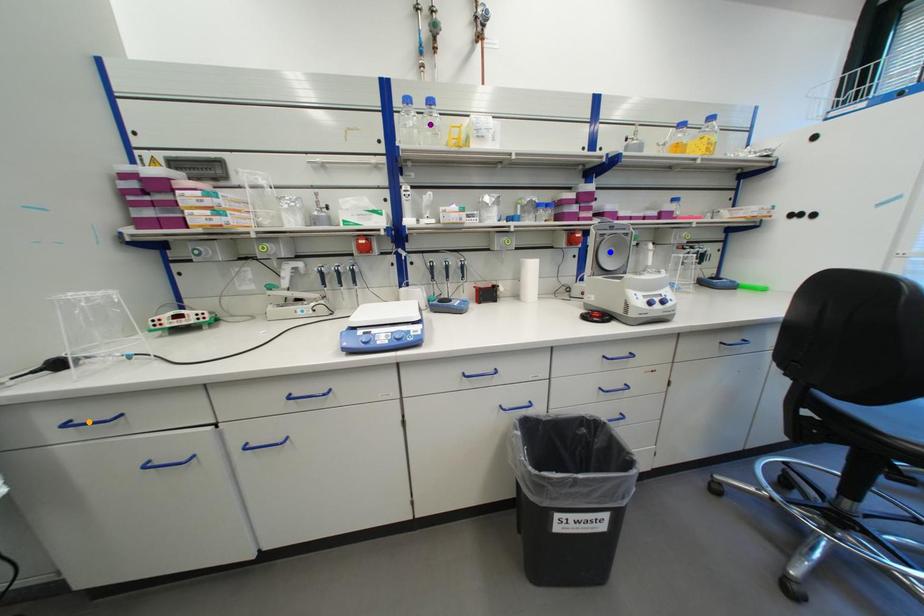
Order these from farthest to nearest:
orange point
purple point
blue point

1. blue point
2. purple point
3. orange point